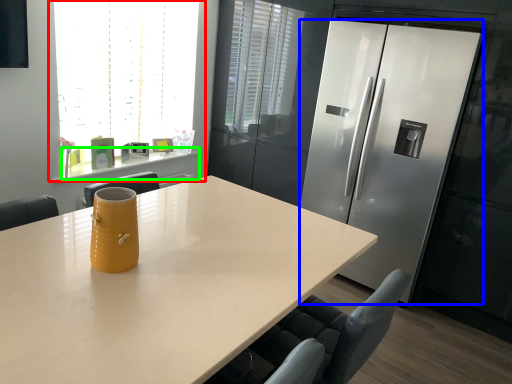
Question: Considering the real-world distances, which object is closest to window (highlighted by a red box)? refrigerator (highlighted by a blue box) or counter (highlighted by a green box).

Choices:
 (A) refrigerator
 (B) counter

Answer: (B)